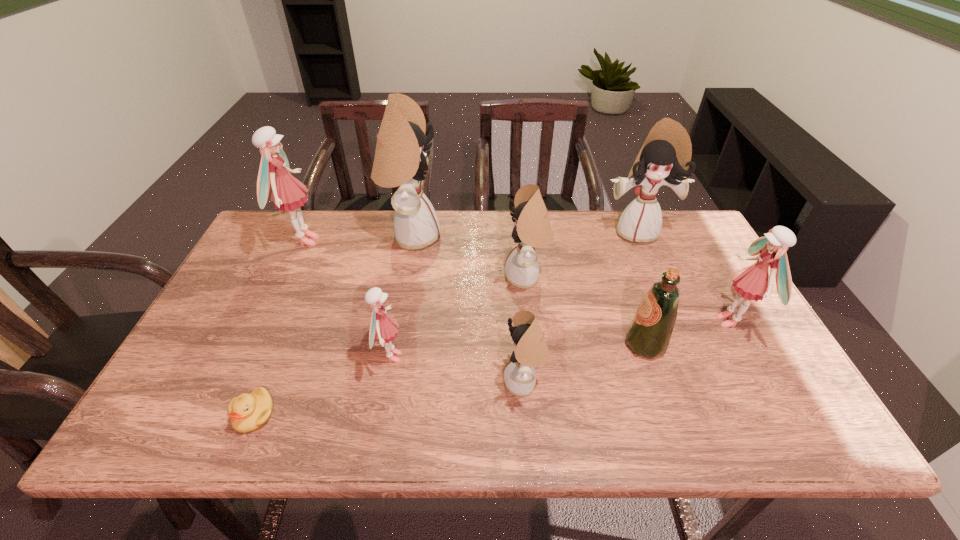
Identify which object is the fifth closest to the yellow duckling. Please provide its 2D coordinates. Your answer should be formatted as a tuple, i.e. [(x, y)], where the tuple contains the x and y coordinates of a point satisfying the conditions above.

[(532, 229)]

In order to click on the third closest doll to the nearest black doll in this screenshot , I will do `click(400, 160)`.

At what (x,y) coordinates should I click in order to perform the action: click on doll that is the closest to the second smallest black doll. Please return your answer as a coordinate pair (x, y). This screenshot has width=960, height=540. Looking at the image, I should click on (531, 350).

Find the location of a particular element. black doll that is the fourth nearest to the olive oil is located at coordinates (400, 160).

Where is `the closest black doll to the olive oil`? This screenshot has height=540, width=960. the closest black doll to the olive oil is located at coordinates tap(532, 229).

Locate which pink doll ranks third in proximity to the nearest black doll. Please provide its 2D coordinates. Your answer should be formatted as a tuple, i.e. [(x, y)], where the tuple contains the x and y coordinates of a point satisfying the conditions above.

[(286, 191)]

Select which pink doll is the closest to the rightmost black doll. Please provide its 2D coordinates. Your answer should be formatted as a tuple, i.e. [(x, y)], where the tuple contains the x and y coordinates of a point satisfying the conditions above.

[(753, 282)]

Find the location of a particular element. free space that satisfies the following two spatial constraints: 1. at the front face of the leftmost black doll; 2. at the face of the duckling is located at coordinates (379, 414).

Locate an element on the screen. Image resolution: width=960 pixels, height=540 pixels. free spot that satisfies the following two spatial constraints: 1. on the front-facing side of the rightmost pink doll; 2. at the face of the yellow duckling is located at coordinates (782, 414).

Image resolution: width=960 pixels, height=540 pixels. In order to click on free point that satisfies the following two spatial constraints: 1. on the front-facing side of the olive oil; 2. at the face of the duckling in this screenshot , I will do `click(669, 414)`.